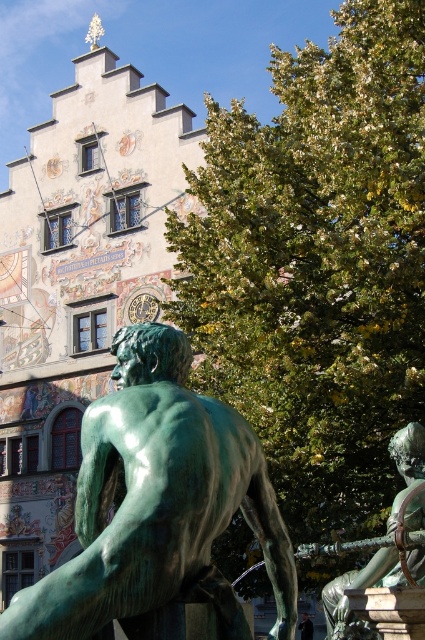
Question: Where is green patina bronze at center located in relation to green patina sword at right in the image?

Choices:
 (A) left
 (B) right

Answer: (A)

Question: Can you confirm if green patina bronze at center is positioned above green patina sword at right?

Choices:
 (A) no
 (B) yes

Answer: (B)

Question: Which point is closer to the camera?

Choices:
 (A) green patina sword at right
 (B) green patina bronze at center

Answer: (B)

Question: Is green patina bronze at center positioned in front of green patina sword at right?

Choices:
 (A) no
 (B) yes

Answer: (B)